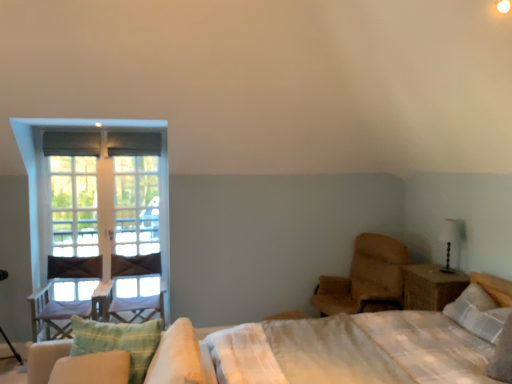
Question: From a real-world perspective, is white glass screen door at left located higher than wooden nightstand at right?

Choices:
 (A) no
 (B) yes

Answer: (B)

Question: From the image's perspective, is white glass screen door at left located above wooden nightstand at right?

Choices:
 (A) yes
 (B) no

Answer: (A)

Question: Is white glass screen door at left wider than wooden nightstand at right?

Choices:
 (A) no
 (B) yes

Answer: (A)

Question: Does white glass screen door at left touch wooden nightstand at right?

Choices:
 (A) yes
 (B) no

Answer: (B)

Question: Is white glass screen door at left far away from wooden nightstand at right?

Choices:
 (A) yes
 (B) no

Answer: (A)

Question: Is white glass screen door at left outside of wooden nightstand at right?

Choices:
 (A) yes
 (B) no

Answer: (A)

Question: Is white textured pillow at upper right, the first pillow in the back-to-front sequence, outside white wooden window at left, the 2th window from the left?

Choices:
 (A) yes
 (B) no

Answer: (A)

Question: Considering the relative sizes of white textured pillow at upper right, the second pillow in the left-to-right sequence, and white wooden window at left, positioned as the 1th window in right-to-left order, in the image provided, is white textured pillow at upper right, the second pillow in the left-to-right sequence, taller than white wooden window at left, positioned as the 1th window in right-to-left order,?

Choices:
 (A) no
 (B) yes

Answer: (A)

Question: Can you confirm if white textured pillow at upper right, the second pillow in the left-to-right sequence, is shorter than white wooden window at left, the 2th window from the left?

Choices:
 (A) yes
 (B) no

Answer: (A)

Question: From a real-world perspective, is white textured pillow at upper right, which ranks as the 2th pillow in front-to-back order, beneath white wooden window at left, the 2th window from the left?

Choices:
 (A) yes
 (B) no

Answer: (A)

Question: Does white textured pillow at upper right, the second pillow in the left-to-right sequence, come behind white wooden window at left, the 2th window from the left?

Choices:
 (A) yes
 (B) no

Answer: (B)

Question: Can you confirm if light beige fabric mattress at right is thinner than green striped pillow at lower left, the 2th pillow viewed from the right?

Choices:
 (A) no
 (B) yes

Answer: (A)